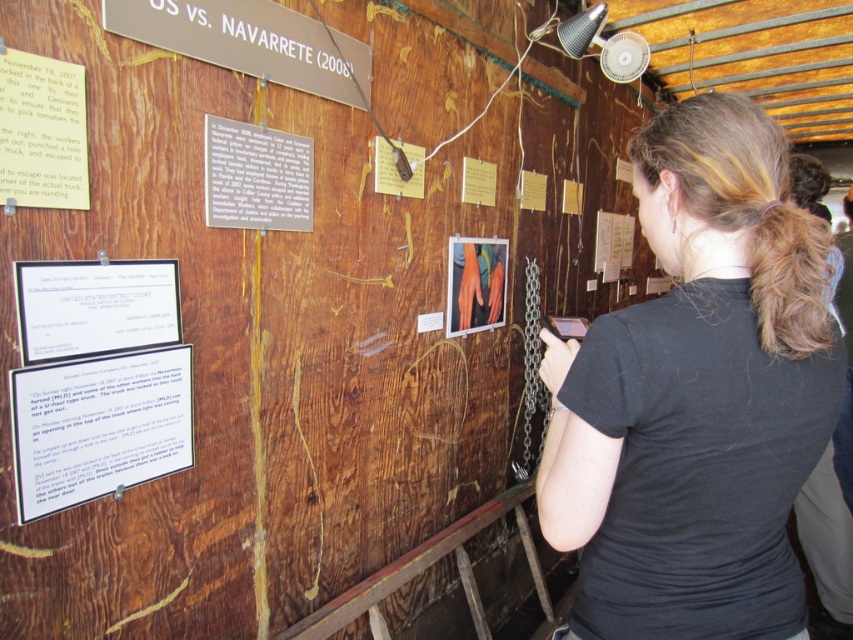
Question: Which object is the farthest from the white paper at lower left?

Choices:
 (A) gray paper at upper center
 (B) matte orange gloves at center

Answer: (B)

Question: Is white paper at left to the left of wooden sign at upper center from the viewer's perspective?

Choices:
 (A) yes
 (B) no

Answer: (A)

Question: Is black cotton shirt at right positioned in front of blonde curly hair at upper right?

Choices:
 (A) yes
 (B) no

Answer: (A)

Question: Is white paper at lower left to the left of gray paper at upper center from the viewer's perspective?

Choices:
 (A) yes
 (B) no

Answer: (A)

Question: Which object is closer to the camera taking this photo?

Choices:
 (A) blonde curly hair at upper right
 (B) wooden sign at upper center

Answer: (A)

Question: Which object appears closest to the camera in this image?

Choices:
 (A) blonde curly hair at upper right
 (B) wooden sign at upper center
 (C) white paper at left

Answer: (A)